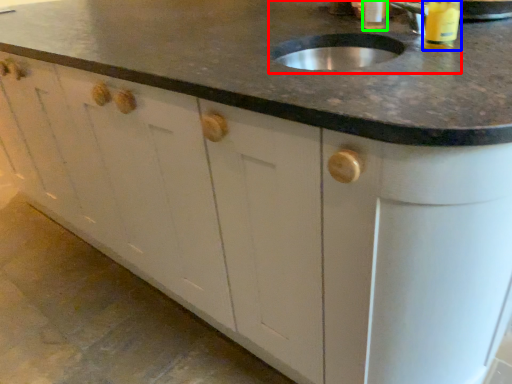
Question: Which is nearer to the sink (highlighted by a red box)? beverage (highlighted by a blue box) or beverage (highlighted by a green box).

Choices:
 (A) beverage
 (B) beverage

Answer: (A)